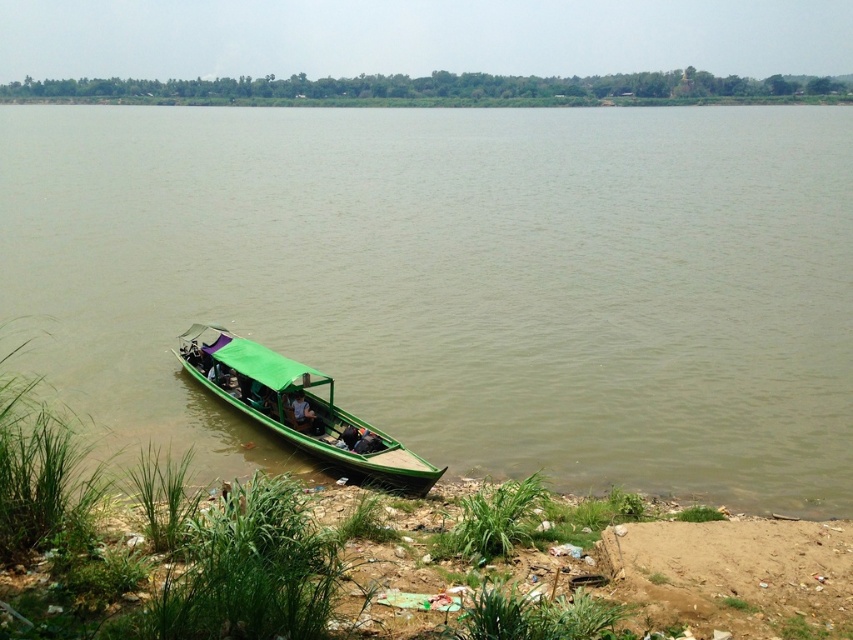
Which is below, green wooden boat at lower left or green matte boat at lower center?

green matte boat at lower center is lower down.

Can you confirm if green wooden boat at lower left is wider than green matte boat at lower center?

Yes, green wooden boat at lower left is wider than green matte boat at lower center.

You are a GUI agent. You are given a task and a screenshot of the screen. Output one action in this format:
    pyautogui.click(x=<x>, y=<y>)
    Task: Click on the green wooden boat at lower left
    This screenshot has height=640, width=853.
    Given the screenshot: What is the action you would take?
    pyautogui.click(x=457, y=282)

Where is `green wooden boat at lower left`? green wooden boat at lower left is located at coordinates (457, 282).

Does point (253, 317) lie behind point (300, 424)?

Yes, it is.

Who is positioned more to the left, green wooden boat at lower left or green fabric person at center?

green fabric person at center is more to the left.

Image resolution: width=853 pixels, height=640 pixels. I want to click on green wooden boat at lower left, so click(x=457, y=282).

Where is `green wooden boat at lower left`? The height and width of the screenshot is (640, 853). green wooden boat at lower left is located at coordinates (457, 282).

Which is behind, point (437, 472) or point (293, 410)?

Point (293, 410)

Which is in front, point (256, 403) or point (299, 396)?

Point (299, 396)

What do you see at coordinates (291, 408) in the screenshot? I see `green matte boat at lower center` at bounding box center [291, 408].

Locate an element on the screen. This screenshot has height=640, width=853. green matte boat at lower center is located at coordinates (291, 408).